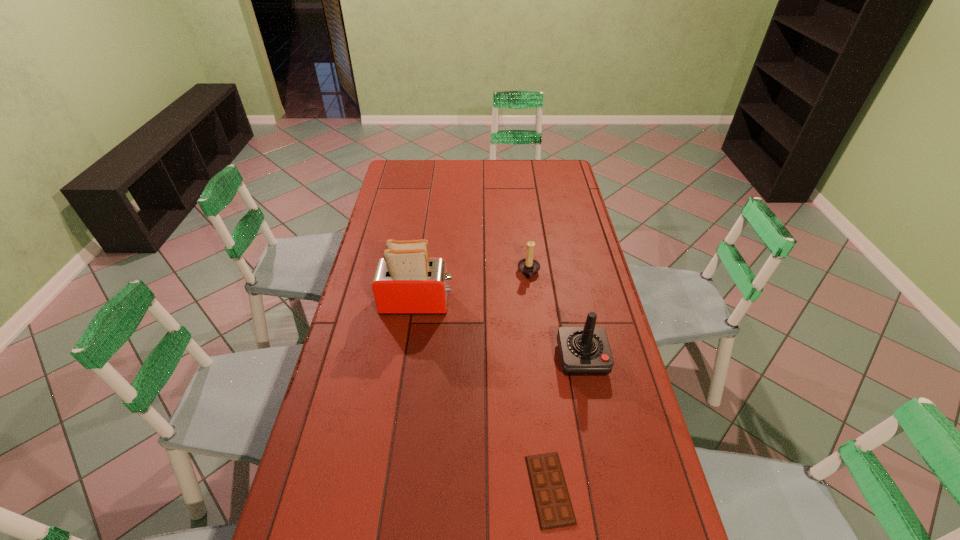
Where is `vacant space that is in between the shortest object and the third farthest object`? Image resolution: width=960 pixels, height=540 pixels. vacant space that is in between the shortest object and the third farthest object is located at coordinates (565, 424).

Find the location of a particular element. The image size is (960, 540). empty space that is in between the nearest object and the candle holder is located at coordinates (540, 381).

The height and width of the screenshot is (540, 960). I want to click on free space between the candle holder and the second tallest object, so click(555, 315).

You are a GUI agent. You are given a task and a screenshot of the screen. Output one action in this format:
    pyautogui.click(x=<x>, y=<y>)
    Task: Click on the vacant area that lies between the farthest object and the toaster
    Image resolution: width=960 pixels, height=540 pixels.
    Given the screenshot: What is the action you would take?
    pyautogui.click(x=473, y=288)

Locate an element on the screen. This screenshot has width=960, height=540. free spot between the shortest object and the rightmost object is located at coordinates (565, 424).

Identify the location of vacant space in between the candle holder and the toaster. The width and height of the screenshot is (960, 540). (473, 288).

This screenshot has width=960, height=540. I want to click on free space that is in between the third shortest object and the chocolate bar, so click(565, 424).

Locate an element on the screen. free area in between the second nearest object and the candle holder is located at coordinates (555, 315).

In order to click on blank region between the chocolate bar and the second farthest object in this screenshot , I will do [x=483, y=396].

At what (x,y) coordinates should I click in order to perform the action: click on object that can be found as the second closest to the third shortest object. Please return your answer as a coordinate pair (x, y). This screenshot has width=960, height=540. Looking at the image, I should click on (528, 266).